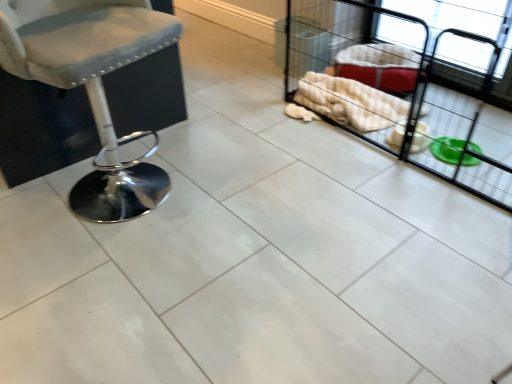
The height and width of the screenshot is (384, 512). In order to click on free area below white fabric baby carriage at right (from a real-world perspective) in this screenshot , I will do `click(426, 142)`.